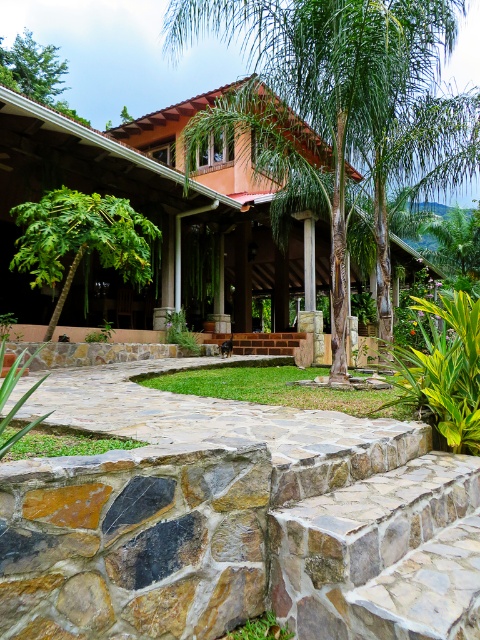
Can you confirm if green leafy tree at left is thinner than green leafy tree at upper left?

Correct, green leafy tree at left's width is less than green leafy tree at upper left's.

The height and width of the screenshot is (640, 480). Describe the element at coordinates (81, 237) in the screenshot. I see `green leafy tree at left` at that location.

Between point (47, 209) and point (31, 45), which one is positioned in front?

Point (47, 209) is more forward.

Locate an element on the screen. green leafy tree at left is located at coordinates (81, 237).

Which is above, green leafy palm tree at center or green leafy tree at left?

green leafy palm tree at center is above.

Who is more distant from viewer, (x=462, y=160) or (x=58, y=202)?

The point (x=462, y=160) is behind.

Image resolution: width=480 pixels, height=640 pixels. Identify the location of green leafy palm tree at center. (345, 108).

The image size is (480, 640). What do you see at coordinates (345, 108) in the screenshot?
I see `green leafy palm tree at center` at bounding box center [345, 108].

Is green leafy palm tree at center closer to the viewer compared to green leafy tree at upper left?

Yes, it is in front of green leafy tree at upper left.

The height and width of the screenshot is (640, 480). I want to click on green leafy palm tree at center, so click(x=345, y=108).